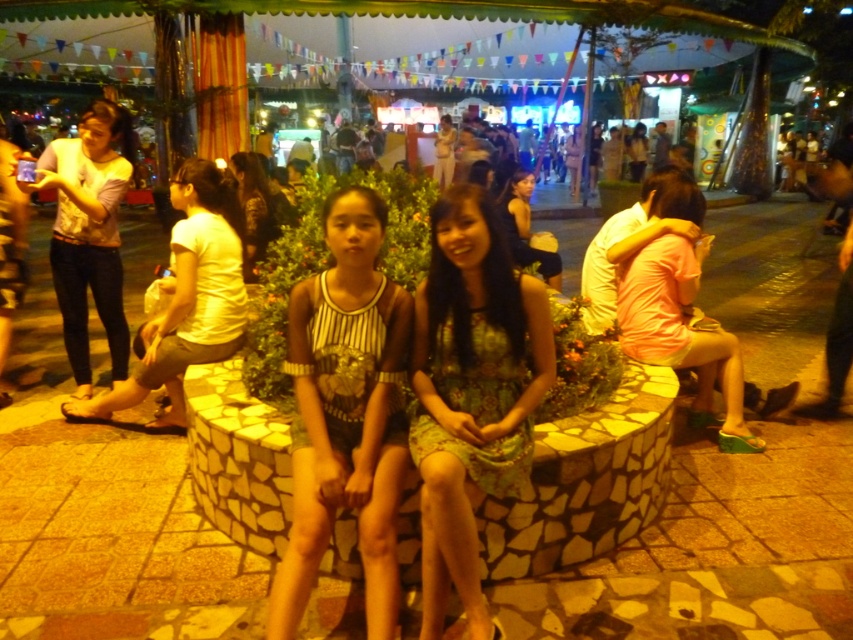
Question: Is white cotton shirt at left above matte black dress at upper right?

Choices:
 (A) no
 (B) yes

Answer: (A)

Question: Does matte white shirt at left have a larger size compared to matte black dress at upper right?

Choices:
 (A) yes
 (B) no

Answer: (B)

Question: Can you confirm if matte white shirt at left is bigger than pink fabric dress at right?

Choices:
 (A) yes
 (B) no

Answer: (A)

Question: Which of the following is the farthest from the observer?

Choices:
 (A) matte white shirt at left
 (B) printed fabric dress at center
 (C) pink fabric dress at right
 (D) white cotton shirt at left

Answer: (A)

Question: Among these points, which one is farthest from the camera?

Choices:
 (A) (518, 256)
 (B) (390, 408)
 (C) (135, 400)

Answer: (A)

Question: Which object is the closest to the pink fabric dress at right?

Choices:
 (A) striped fabric dress at center
 (B) matte black dress at upper right

Answer: (A)